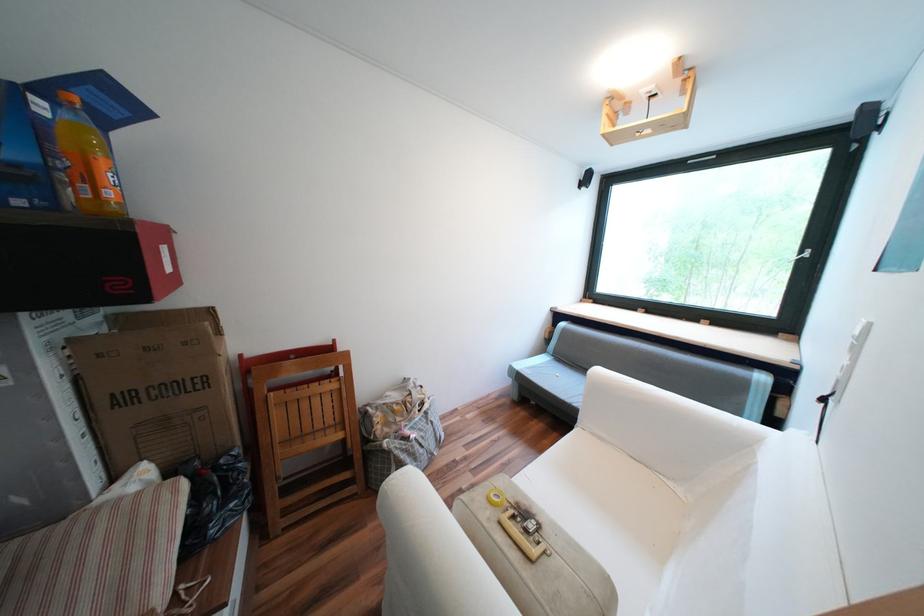
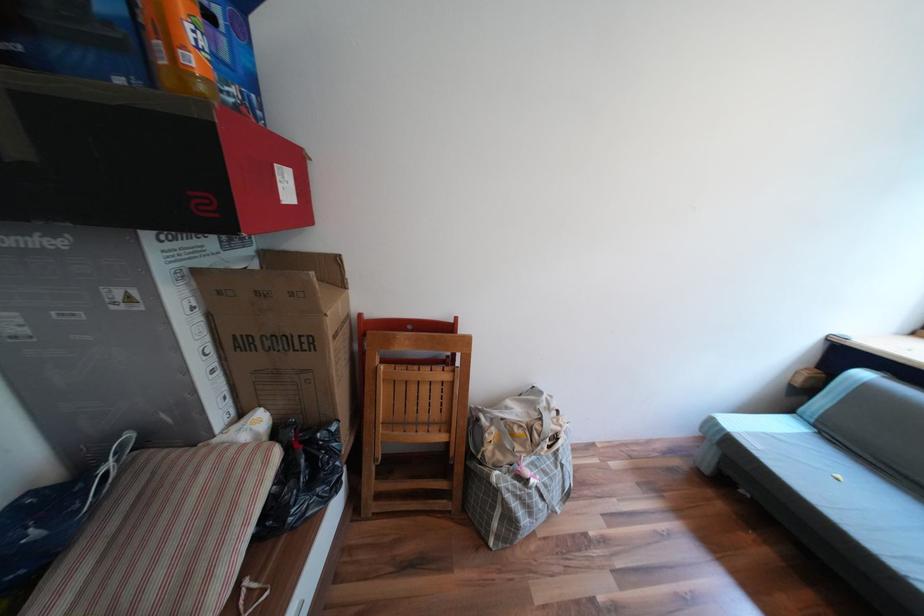
Question: The first image is from the beginning of the video and the second image is from the end. How did the camera likely rotate when shooting the video?

Choices:
 (A) Left
 (B) Right
 (C) Up
 (D) Down

Answer: (A)